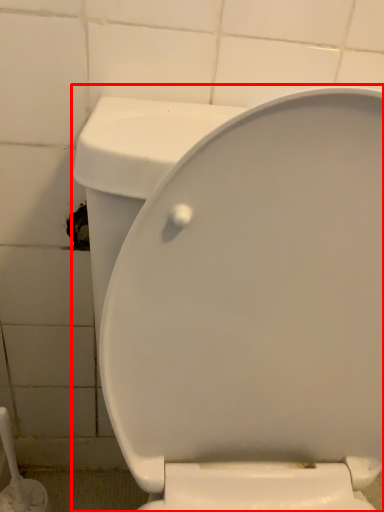
Question: From the image's perspective, where is toilet (annotated by the red box) located in relation to brush in the image?

Choices:
 (A) above
 (B) below

Answer: (A)